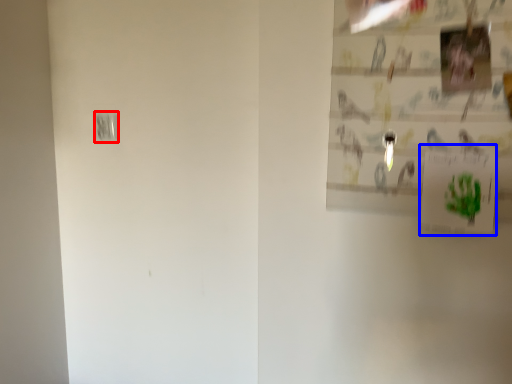
Question: Which point is closer to the camera, light switch (highlighted by a red box) or postcard (highlighted by a blue box)?

Choices:
 (A) light switch
 (B) postcard

Answer: (B)